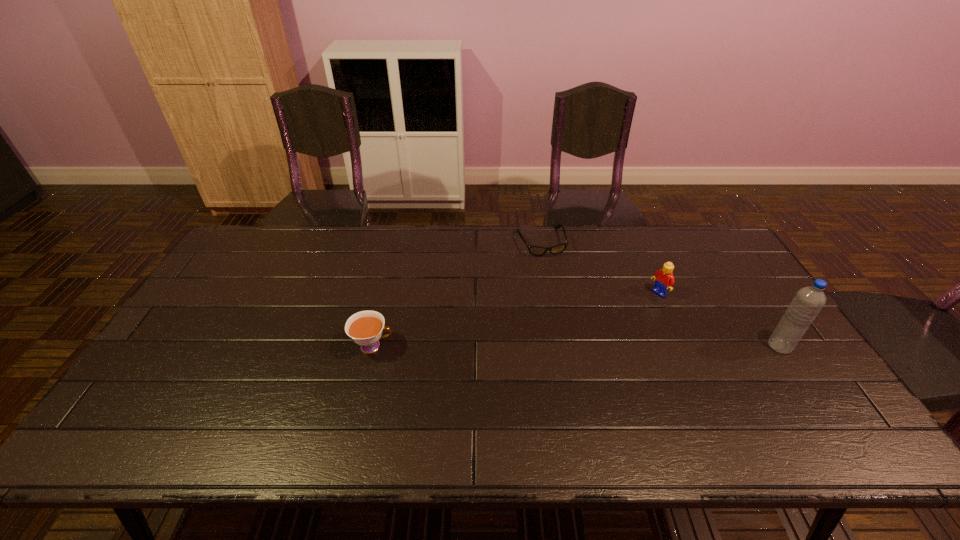
In order to click on vacant region at the left edge of the desktop in this screenshot , I will do `click(193, 332)`.

This screenshot has width=960, height=540. What are the coordinates of `vacant area at the right edge of the desktop` in the screenshot? It's located at (787, 355).

I want to click on free region at the far left corner of the desktop, so click(258, 244).

I want to click on vacant space at the far right corner of the desktop, so click(705, 228).

This screenshot has width=960, height=540. I want to click on vacant space at the near right corner of the desktop, so click(832, 415).

The width and height of the screenshot is (960, 540). Find the location of `empty space that is in between the third shortest object and the rightmost object`. empty space that is in between the third shortest object and the rightmost object is located at coordinates (719, 320).

Find the location of a particular element. vacant point located between the second shortest object and the rightmost object is located at coordinates (576, 346).

At what (x,y) coordinates should I click in order to perform the action: click on vacant area that lies between the rightmost object and the third shortest object. Please return your answer as a coordinate pair (x, y). The height and width of the screenshot is (540, 960). Looking at the image, I should click on (719, 320).

Where is `empty space that is in between the Lego and the third object from right to left`? This screenshot has width=960, height=540. empty space that is in between the Lego and the third object from right to left is located at coordinates (600, 268).

Where is `free space that is in between the spectacles and the third nearest object`? free space that is in between the spectacles and the third nearest object is located at coordinates pyautogui.click(x=600, y=268).